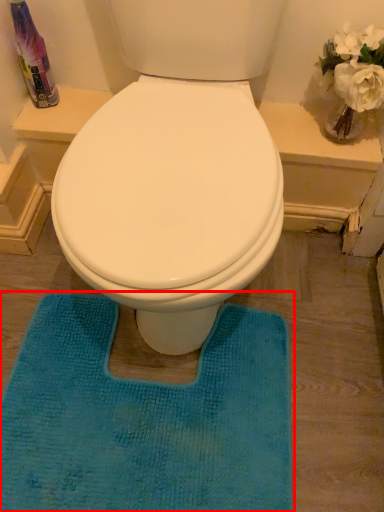
Question: From the image's perspective, where is bath mat (annotated by the red box) located in relation to cleaning product in the image?

Choices:
 (A) below
 (B) above

Answer: (A)